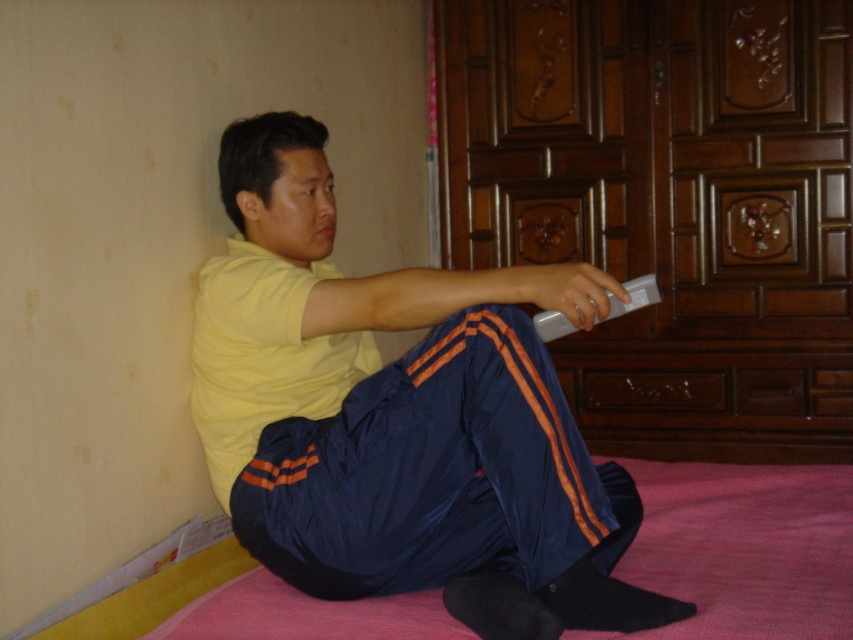
Question: Among these objects, which one is farthest from the camera?

Choices:
 (A) silver metallic remote at center
 (B) yellow matte shirt at center

Answer: (A)

Question: Can you confirm if yellow matte shirt at center is bigger than silver metallic remote at center?

Choices:
 (A) yes
 (B) no

Answer: (A)

Question: Is yellow matte shirt at center closer to the viewer compared to silver metallic remote at center?

Choices:
 (A) no
 (B) yes

Answer: (B)

Question: Does yellow matte shirt at center appear under silver metallic remote at center?

Choices:
 (A) no
 (B) yes

Answer: (B)

Question: Which point is farther from the camera taking this photo?

Choices:
 (A) (256, 486)
 (B) (660, 296)

Answer: (A)

Question: Which of the following is the farthest from the observer?

Choices:
 (A) (643, 307)
 (B) (207, 387)

Answer: (B)